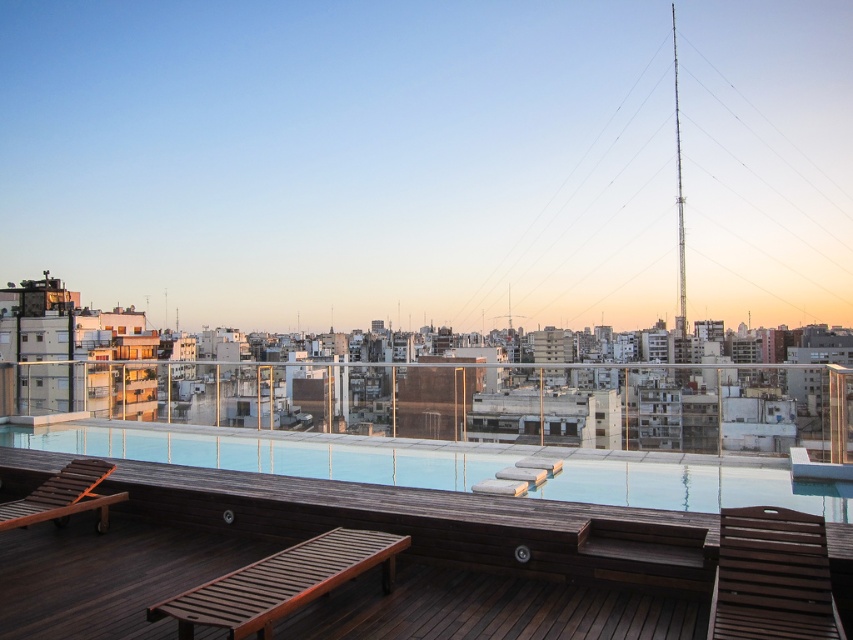
You are a guest at a rooftop hotel and want to lie down comfortably. You see the wooden slatted daybed at lower center and the brown wooden lounge chair at lower left. Which one is positioned to the right side of the other?

The wooden slatted daybed at lower center is positioned to the right of the brown wooden lounge chair at lower left.

You are standing on the rooftop and want to place a new lounge chair. The existing lounge chairs are already placed on the smooth wooden deck at lower center located at point [270,454]. Where should you place the new lounge chair to ensure it is on the same deck?

The smooth wooden deck at lower center is located at point [270,454], so you should place the new lounge chair at the same coordinates to ensure it is on the same deck.